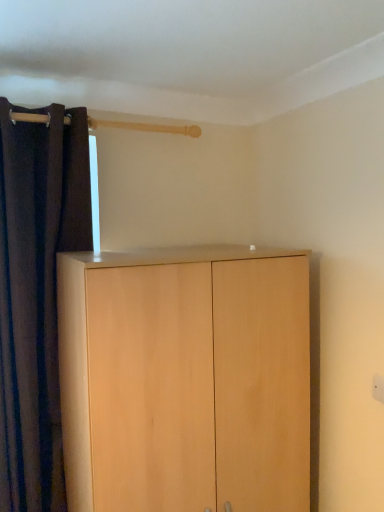
Question: Is dark fabric curtain at left inside or outside of light wood cupboard at center?

Choices:
 (A) inside
 (B) outside

Answer: (B)

Question: In terms of size, does dark fabric curtain at left appear bigger or smaller than light wood cupboard at center?

Choices:
 (A) small
 (B) big

Answer: (A)

Question: Considering the positions of point (49, 342) and point (195, 268), is point (49, 342) closer or farther from the camera than point (195, 268)?

Choices:
 (A) closer
 (B) farther

Answer: (B)

Question: Based on their positions, is light wood cupboard at center located to the left or right of dark fabric curtain at left?

Choices:
 (A) right
 (B) left

Answer: (A)

Question: Is point (130, 349) closer or farther from the camera than point (49, 307)?

Choices:
 (A) closer
 (B) farther

Answer: (A)

Question: Relative to dark fabric curtain at left, is light wood cupboard at center in front or behind?

Choices:
 (A) front
 (B) behind

Answer: (A)

Question: Based on their sizes in the image, would you say light wood cupboard at center is bigger or smaller than dark fabric curtain at left?

Choices:
 (A) small
 (B) big

Answer: (B)